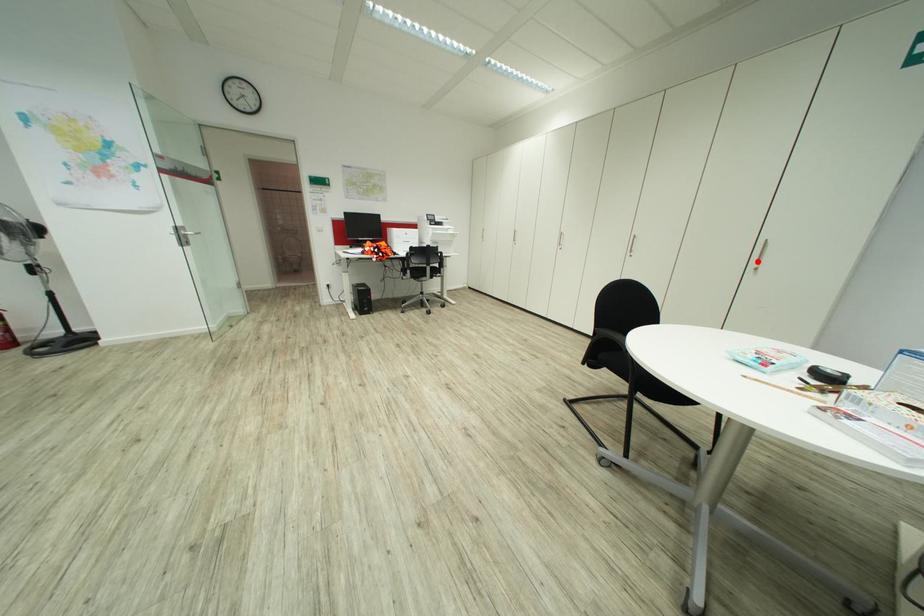
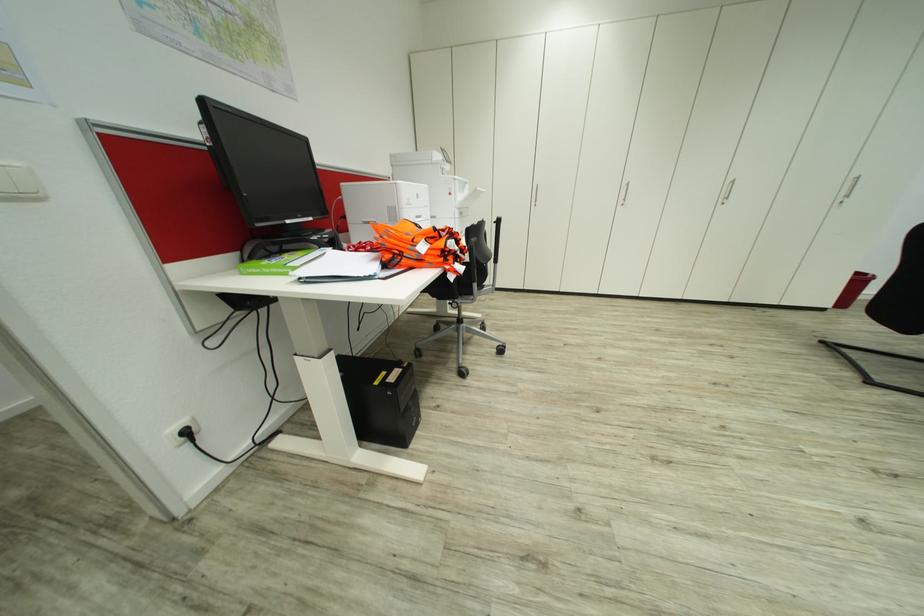
Where in the second image is the point corresponding to the highlighted location from the first image?

(845, 195)